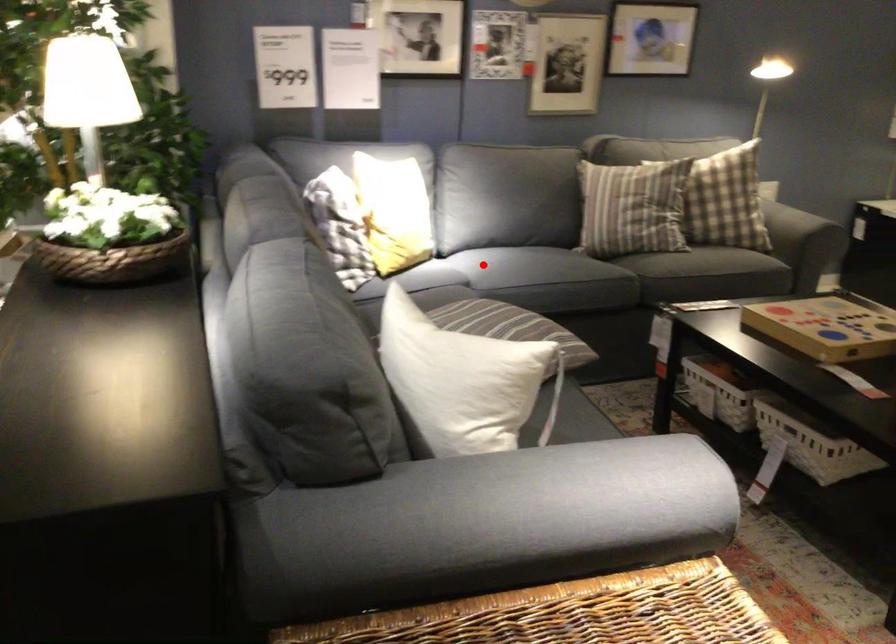
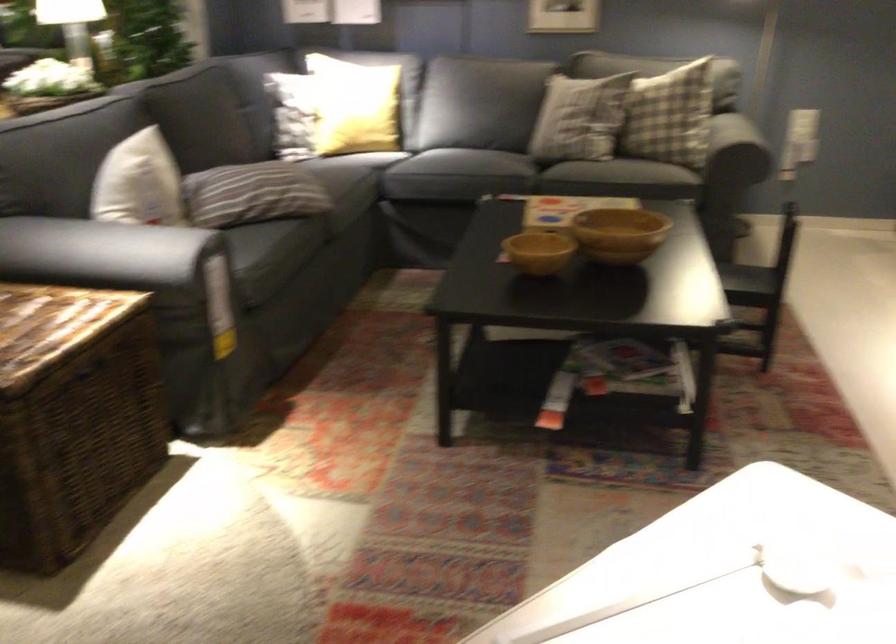
In the second image, find the point that corresponds to the highlighted location in the first image.

(386, 149)